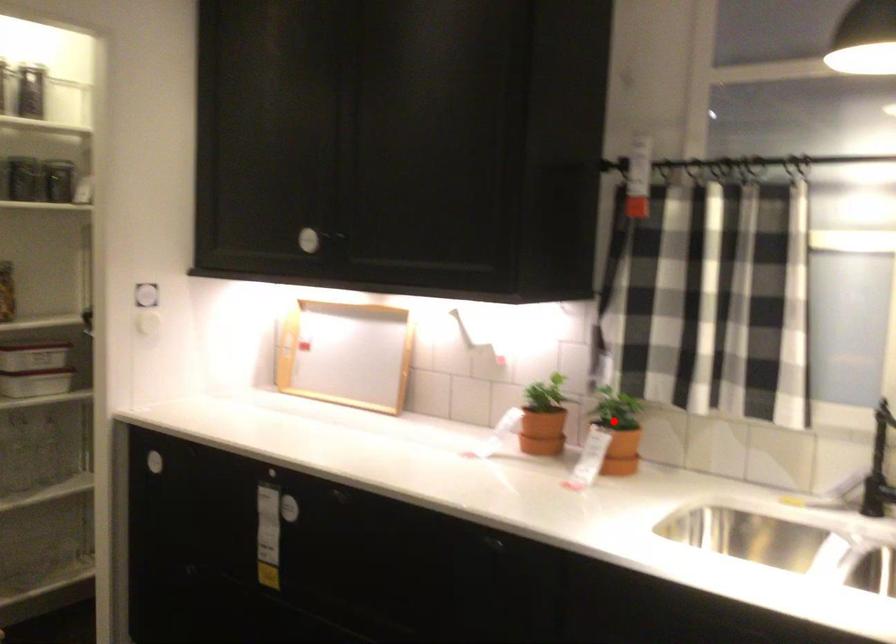
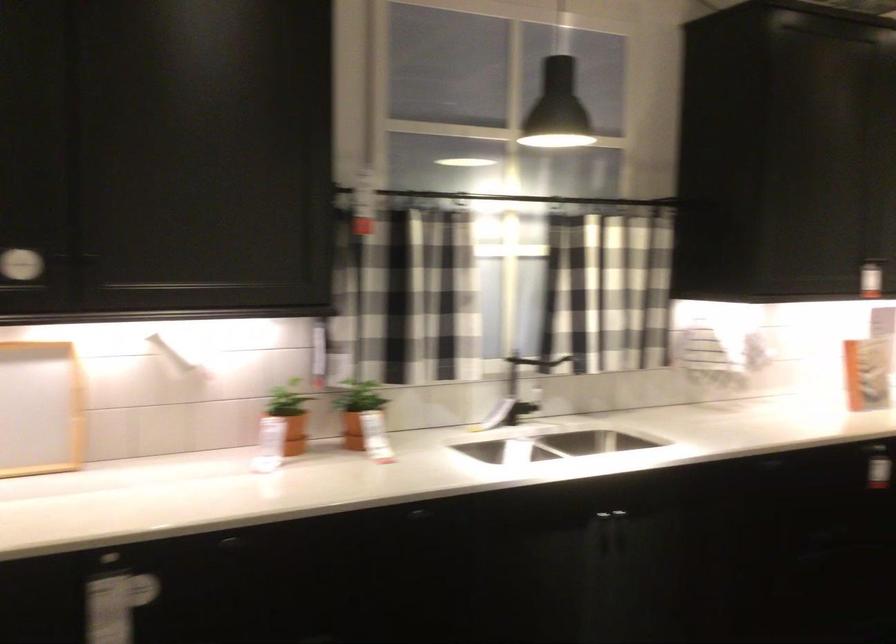
Question: I am providing you with two images of the same scene from different viewpoints. A red point is shown in image1. For the corresponding object point in image2, is it positioned nearer or farther from the camera?

Choices:
 (A) Nearer
 (B) Farther

Answer: (B)